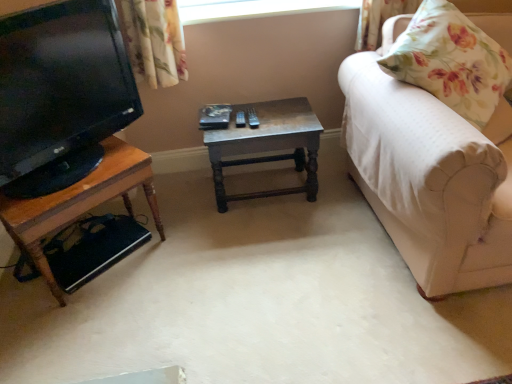
The image size is (512, 384). I want to click on free space to the left of wooden table at center, positioned as the second table in left-to-right order, so click(188, 206).